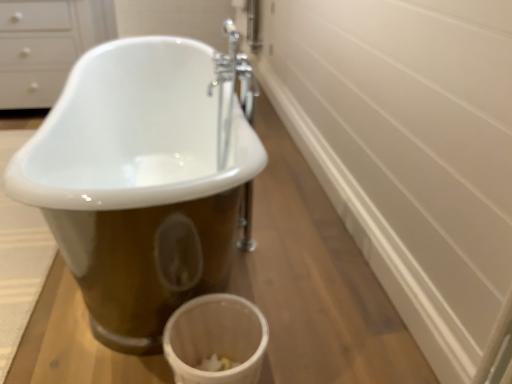
Question: From a real-world perspective, does white matte toilet bowl at lower center stand above white porcelain bathtub at center?

Choices:
 (A) yes
 (B) no

Answer: (A)

Question: Is white porcelain bathtub at center a part of white matte toilet bowl at lower center?

Choices:
 (A) yes
 (B) no

Answer: (B)

Question: From the image's perspective, is white matte toilet bowl at lower center below white porcelain bathtub at center?

Choices:
 (A) yes
 (B) no

Answer: (A)

Question: Is white matte toilet bowl at lower center touching white porcelain bathtub at center?

Choices:
 (A) yes
 (B) no

Answer: (B)

Question: Considering the relative sizes of white matte toilet bowl at lower center and white porcelain bathtub at center in the image provided, is white matte toilet bowl at lower center taller than white porcelain bathtub at center?

Choices:
 (A) yes
 (B) no

Answer: (A)

Question: From a real-world perspective, relative to chrome metallic faucet at center, is white glossy drawer at upper left vertically above or below?

Choices:
 (A) below
 (B) above

Answer: (A)

Question: Would you say white glossy drawer at upper left is inside or outside chrome metallic faucet at center?

Choices:
 (A) inside
 (B) outside

Answer: (B)

Question: Is white glossy drawer at upper left bigger or smaller than chrome metallic faucet at center?

Choices:
 (A) small
 (B) big

Answer: (B)

Question: Does point (11, 94) appear closer or farther from the camera than point (228, 38)?

Choices:
 (A) closer
 (B) farther

Answer: (B)

Question: Relative to white textured bath mat at lower left, is white porcelain bathtub at center in front or behind?

Choices:
 (A) front
 (B) behind

Answer: (A)

Question: From the image's perspective, is white porcelain bathtub at center positioned above or below white textured bath mat at lower left?

Choices:
 (A) below
 (B) above

Answer: (B)

Question: Based on their positions, is white porcelain bathtub at center located to the left or right of white textured bath mat at lower left?

Choices:
 (A) left
 (B) right

Answer: (B)

Question: Is white porcelain bathtub at center bigger or smaller than white textured bath mat at lower left?

Choices:
 (A) small
 (B) big

Answer: (B)

Question: In the image, is white textured bath mat at lower left on the left side or the right side of white glossy drawer at upper left?

Choices:
 (A) right
 (B) left

Answer: (A)

Question: From their relative heights in the image, would you say white textured bath mat at lower left is taller or shorter than white glossy drawer at upper left?

Choices:
 (A) tall
 (B) short

Answer: (B)